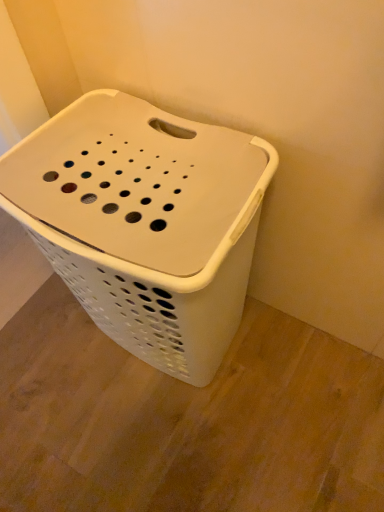
Find the location of a particular element. vacant area that is in front of white plastic laundry basket at center is located at coordinates (183, 448).